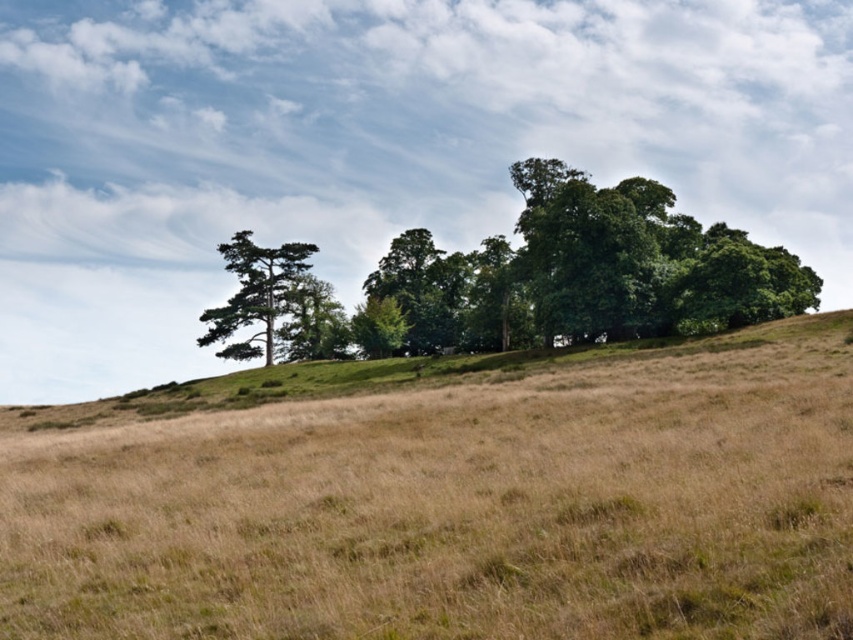
Question: Can you confirm if brown grassy hillside at center is thinner than green leafy tree at center?

Choices:
 (A) no
 (B) yes

Answer: (B)

Question: Among these objects, which one is farthest from the camera?

Choices:
 (A) green matte tree at left
 (B) brown grassy hillside at center

Answer: (A)

Question: Which point appears farthest from the camera in this image?

Choices:
 (A) (440, 292)
 (B) (254, 339)

Answer: (A)

Question: From the image, what is the correct spatial relationship of green leafy tree at center in relation to green matte tree at left?

Choices:
 (A) left
 (B) right

Answer: (B)

Question: Which of the following is the closest to the observer?

Choices:
 (A) (292, 252)
 (B) (782, 289)
 (C) (187, 445)

Answer: (C)

Question: Can you confirm if green leafy tree at center is wider than green matte tree at left?

Choices:
 (A) yes
 (B) no

Answer: (A)